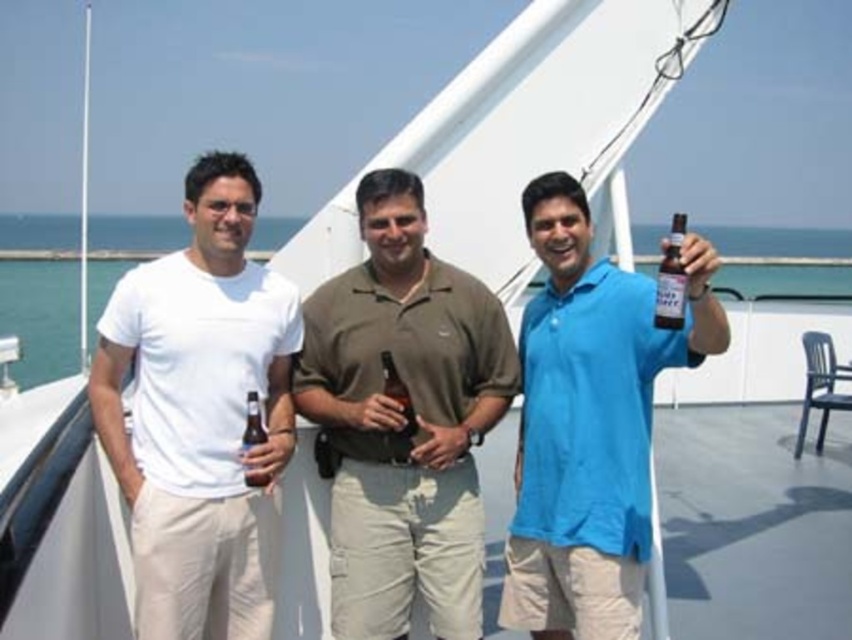
Question: Which of these objects is positioned closest to the matte brown bottle at center?

Choices:
 (A) translucent glass bottle at upper right
 (B) blue matte shirt at center
 (C) white cotton t-shirt at left

Answer: (C)

Question: Does white cotton t-shirt at left have a larger size compared to matte brown bottle at center?

Choices:
 (A) no
 (B) yes

Answer: (B)

Question: Is the position of white cotton t-shirt at left less distant than that of translucent glass bottle at upper right?

Choices:
 (A) yes
 (B) no

Answer: (B)

Question: Estimate the real-world distances between objects in this image. Which object is farther from the matte brown bottle at center?

Choices:
 (A) matte brown shirt at center
 (B) brown glass bottle at center
 (C) white cotton t-shirt at left
 (D) translucent glass bottle at upper right

Answer: (D)

Question: Is white cotton t-shirt at left bigger than translucent glass bottle at upper right?

Choices:
 (A) yes
 (B) no

Answer: (A)

Question: Which object is positioned closest to the translucent glass bottle at upper right?

Choices:
 (A) matte brown shirt at center
 (B) white cotton t-shirt at left
 (C) matte brown bottle at center

Answer: (A)